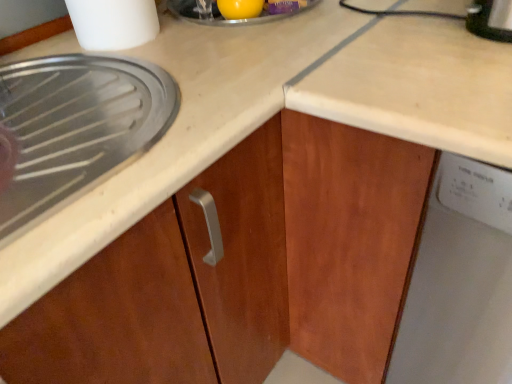
Question: Should I look upward or downward to see white plastic dishwasher at right?

Choices:
 (A) up
 (B) down

Answer: (B)

Question: Is white plastic dishwasher at right not within white plastic container at upper left?

Choices:
 (A) no
 (B) yes

Answer: (B)

Question: Can you confirm if white plastic dishwasher at right is thinner than white plastic container at upper left?

Choices:
 (A) no
 (B) yes

Answer: (A)

Question: Considering the relative sizes of white plastic dishwasher at right and white plastic container at upper left in the image provided, is white plastic dishwasher at right taller than white plastic container at upper left?

Choices:
 (A) no
 (B) yes

Answer: (B)

Question: Is white plastic dishwasher at right smaller than white plastic container at upper left?

Choices:
 (A) no
 (B) yes

Answer: (A)

Question: From a real-world perspective, is white plastic dishwasher at right located higher than white plastic container at upper left?

Choices:
 (A) no
 (B) yes

Answer: (A)

Question: Is white plastic dishwasher at right far from white plastic container at upper left?

Choices:
 (A) no
 (B) yes

Answer: (A)

Question: Is white plastic container at upper left outside white plastic dishwasher at right?

Choices:
 (A) yes
 (B) no

Answer: (A)

Question: From a real-world perspective, is white plastic container at upper left positioned over white plastic dishwasher at right based on gravity?

Choices:
 (A) yes
 (B) no

Answer: (A)

Question: From the image's perspective, does white plastic container at upper left appear lower than white plastic dishwasher at right?

Choices:
 (A) no
 (B) yes

Answer: (A)

Question: Is white plastic container at upper left to the right of white plastic dishwasher at right from the viewer's perspective?

Choices:
 (A) yes
 (B) no

Answer: (B)

Question: Does white plastic container at upper left have a greater height compared to white plastic dishwasher at right?

Choices:
 (A) yes
 (B) no

Answer: (B)

Question: Can you confirm if white plastic container at upper left is smaller than white plastic dishwasher at right?

Choices:
 (A) no
 (B) yes

Answer: (B)

Question: Does yellow rubber ball at upper center have a smaller size compared to white plastic container at upper left?

Choices:
 (A) no
 (B) yes

Answer: (B)